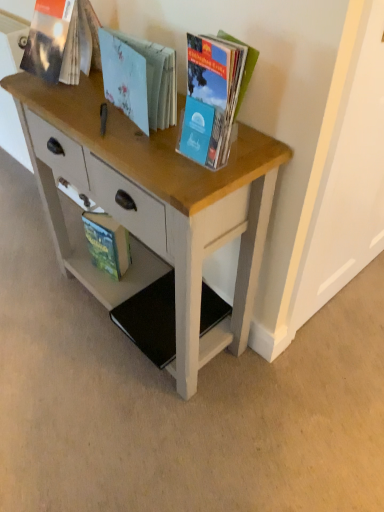
In the scene shown: How much space does matte paper book at upper left, positioned as the second book in back-to-front order, occupy vertically?

matte paper book at upper left, positioned as the second book in back-to-front order, is 8.82 inches in height.

Locate an element on the screen. This screenshot has height=512, width=384. matte plastic book at upper right, the fourth book from the back is located at coordinates (213, 96).

Image resolution: width=384 pixels, height=512 pixels. Describe the element at coordinates (213, 96) in the screenshot. I see `matte plastic book at upper right, the fourth book from the back` at that location.

What do you see at coordinates (154, 204) in the screenshot?
I see `wooden desk at center` at bounding box center [154, 204].

The width and height of the screenshot is (384, 512). What do you see at coordinates (107, 243) in the screenshot?
I see `green matte book at lower left, placed as the 1th book when sorted from back to front` at bounding box center [107, 243].

Find the location of a particular element. The width and height of the screenshot is (384, 512). matte paper book at upper left, marked as the third book in a front-to-back arrangement is located at coordinates (62, 41).

Considering the sizes of objects matte paper book at upper left, positioned as the second book in back-to-front order, and wooden desk at center in the image provided, who is smaller, matte paper book at upper left, positioned as the second book in back-to-front order, or wooden desk at center?

Smaller between the two is matte paper book at upper left, positioned as the second book in back-to-front order.

Considering the points (22, 67) and (280, 147), which point is behind, point (22, 67) or point (280, 147)?

The point (22, 67) is behind.

What are the coordinates of `the 2nd book positioned above the wooden desk at center (from a real-world perspective)` in the screenshot? It's located at (62, 41).

Is point (103, 219) positioned behind point (193, 142)?

Yes, point (103, 219) is behind point (193, 142).

Between green matte book at lower left, the 4th book in the front-to-back sequence, and matte plastic book at upper right, the fourth book from the back, which one is positioned behind?

green matte book at lower left, the 4th book in the front-to-back sequence, is further from the camera.

Which of these two, green matte book at lower left, the 4th book in the front-to-back sequence, or matte plastic book at upper right, the first book in the front-to-back sequence, stands shorter?

With less height is green matte book at lower left, the 4th book in the front-to-back sequence.

From the picture: Can you confirm if green matte book at lower left, placed as the 1th book when sorted from back to front, is smaller than matte plastic book at upper right, the first book in the front-to-back sequence?

Answer: Correct, green matte book at lower left, placed as the 1th book when sorted from back to front, occupies less space than matte plastic book at upper right, the first book in the front-to-back sequence.

Is point (234, 44) in front of point (137, 74)?

Yes, point (234, 44) is in front of point (137, 74).

Based on the photo, in terms of height, does matte plastic book at upper right, the first book in the front-to-back sequence, look taller or shorter compared to light blue paper book at center, which ranks as the third book in back-to-front order?

In the image, matte plastic book at upper right, the first book in the front-to-back sequence, appears to be taller than light blue paper book at center, which ranks as the third book in back-to-front order.

Measure the distance from matte plastic book at upper right, the fourth book from the back, to light blue paper book at center, the 2th book when ordered from front to back.

The distance of matte plastic book at upper right, the fourth book from the back, from light blue paper book at center, the 2th book when ordered from front to back, is 5.83 inches.

Can you confirm if light blue paper book at center, which ranks as the third book in back-to-front order, is positioned to the left of green matte book at lower left, the 4th book in the front-to-back sequence?

Incorrect, light blue paper book at center, which ranks as the third book in back-to-front order, is not on the left side of green matte book at lower left, the 4th book in the front-to-back sequence.

Considering the relative sizes of light blue paper book at center, the 2th book when ordered from front to back, and green matte book at lower left, placed as the 1th book when sorted from back to front, in the image provided, is light blue paper book at center, the 2th book when ordered from front to back, thinner than green matte book at lower left, placed as the 1th book when sorted from back to front,?

No.

Considering the sizes of light blue paper book at center, which ranks as the third book in back-to-front order, and green matte book at lower left, the 4th book in the front-to-back sequence, in the image, is light blue paper book at center, which ranks as the third book in back-to-front order, taller or shorter than green matte book at lower left, the 4th book in the front-to-back sequence,?

In the image, light blue paper book at center, which ranks as the third book in back-to-front order, appears to be shorter than green matte book at lower left, the 4th book in the front-to-back sequence.

Would you say light blue paper book at center, which ranks as the third book in back-to-front order, is outside green matte book at lower left, placed as the 1th book when sorted from back to front?

Absolutely, light blue paper book at center, which ranks as the third book in back-to-front order, is external to green matte book at lower left, placed as the 1th book when sorted from back to front.

Looking at this image, is matte plastic book at upper right, the fourth book from the back, a part of wooden desk at center?

That's incorrect, matte plastic book at upper right, the fourth book from the back, is not inside wooden desk at center.

Is wooden desk at center shorter than matte plastic book at upper right, the fourth book from the back?

Incorrect, the height of wooden desk at center does not fall short of that of matte plastic book at upper right, the fourth book from the back.

Where is `desk below the matte plastic book at upper right, the first book in the front-to-back sequence (from a real-world perspective)`? The width and height of the screenshot is (384, 512). desk below the matte plastic book at upper right, the first book in the front-to-back sequence (from a real-world perspective) is located at coordinates (154, 204).

Is wooden desk at center positioned far away from matte plastic book at upper right, the fourth book from the back?

They are positioned close to each other.

From a real-world perspective, does wooden desk at center stand above matte paper book at upper left, positioned as the second book in back-to-front order?

No, from a real-world perspective, wooden desk at center is not above matte paper book at upper left, positioned as the second book in back-to-front order.

Would you say wooden desk at center is a long distance from matte paper book at upper left, positioned as the second book in back-to-front order?

That's not correct — wooden desk at center is a little close to matte paper book at upper left, positioned as the second book in back-to-front order.

Is point (81, 252) farther from viewer compared to point (98, 45)?

Yes.

Would you say wooden desk at center contains matte paper book at upper left, marked as the third book in a front-to-back arrangement?

No, matte paper book at upper left, marked as the third book in a front-to-back arrangement, is not surrounded by wooden desk at center.

Would you say light blue paper book at center, which ranks as the third book in back-to-front order, contains wooden desk at center?

No, light blue paper book at center, which ranks as the third book in back-to-front order, does not contain wooden desk at center.

Locate an element on the screen. The width and height of the screenshot is (384, 512). the 2nd book positioned above the wooden desk at center (from the image's perspective) is located at coordinates (139, 79).

Looking at this image, would you consider light blue paper book at center, which ranks as the third book in back-to-front order, to be distant from wooden desk at center?

That's not correct — light blue paper book at center, which ranks as the third book in back-to-front order, is a little close to wooden desk at center.

Is point (151, 53) closer or farther from the camera than point (124, 161)?

Point (151, 53) is positioned farther from the camera compared to point (124, 161).

Which book is the 2nd one when counting from the back of the wooden desk at center? Please provide its 2D coordinates.

[(62, 41)]

From the green matte book at lower left, the 4th book in the front-to-back sequence, count 2nd book to the right and point to it. Please provide its 2D coordinates.

[(213, 96)]

From the image, which object appears to be nearer to green matte book at lower left, the 4th book in the front-to-back sequence, wooden desk at center or matte paper book at upper left, marked as the third book in a front-to-back arrangement?

wooden desk at center is positioned closer to the anchor green matte book at lower left, the 4th book in the front-to-back sequence.

From the picture: Which object lies nearer to the anchor point matte paper book at upper left, positioned as the second book in back-to-front order, matte plastic book at upper right, the fourth book from the back, or green matte book at lower left, placed as the 1th book when sorted from back to front?

Based on the image, matte plastic book at upper right, the fourth book from the back, appears to be nearer to matte paper book at upper left, positioned as the second book in back-to-front order.

Which object lies further to the anchor point light blue paper book at center, the 2th book when ordered from front to back, matte paper book at upper left, marked as the third book in a front-to-back arrangement, or green matte book at lower left, the 4th book in the front-to-back sequence?

green matte book at lower left, the 4th book in the front-to-back sequence.

Looking at the image, which one is located closer to light blue paper book at center, the 2th book when ordered from front to back, wooden desk at center or green matte book at lower left, placed as the 1th book when sorted from back to front?

The object closer to light blue paper book at center, the 2th book when ordered from front to back, is wooden desk at center.

Estimate the real-world distances between objects in this image. Which object is closer to matte paper book at upper left, marked as the third book in a front-to-back arrangement, wooden desk at center or matte plastic book at upper right, the first book in the front-to-back sequence?

Among the two, wooden desk at center is located nearer to matte paper book at upper left, marked as the third book in a front-to-back arrangement.

Based on their spatial positions, is matte plastic book at upper right, the first book in the front-to-back sequence, or light blue paper book at center, which ranks as the third book in back-to-front order, further from green matte book at lower left, placed as the 1th book when sorted from back to front?

The object further to green matte book at lower left, placed as the 1th book when sorted from back to front, is matte plastic book at upper right, the first book in the front-to-back sequence.

Which object lies further to the anchor point matte plastic book at upper right, the first book in the front-to-back sequence, green matte book at lower left, placed as the 1th book when sorted from back to front, or light blue paper book at center, which ranks as the third book in back-to-front order?

green matte book at lower left, placed as the 1th book when sorted from back to front, is further to matte plastic book at upper right, the first book in the front-to-back sequence.

Estimate the real-world distances between objects in this image. Which object is closer to matte paper book at upper left, marked as the third book in a front-to-back arrangement, green matte book at lower left, placed as the 1th book when sorted from back to front, or matte plastic book at upper right, the fourth book from the back?

matte plastic book at upper right, the fourth book from the back, lies closer to matte paper book at upper left, marked as the third book in a front-to-back arrangement, than the other object.

This screenshot has height=512, width=384. Find the location of `desk positioned between matte plastic book at upper right, the fourth book from the back, and green matte book at lower left, placed as the 1th book when sorted from back to front, from near to far`. desk positioned between matte plastic book at upper right, the fourth book from the back, and green matte book at lower left, placed as the 1th book when sorted from back to front, from near to far is located at coordinates (154, 204).

Where is `book between light blue paper book at center, which ranks as the third book in back-to-front order, and green matte book at lower left, the 4th book in the front-to-back sequence, along the z-axis`? The width and height of the screenshot is (384, 512). book between light blue paper book at center, which ranks as the third book in back-to-front order, and green matte book at lower left, the 4th book in the front-to-back sequence, along the z-axis is located at coordinates (62, 41).

Locate an element on the screen. This screenshot has width=384, height=512. book between light blue paper book at center, which ranks as the third book in back-to-front order, and wooden desk at center, in the vertical direction is located at coordinates (213, 96).